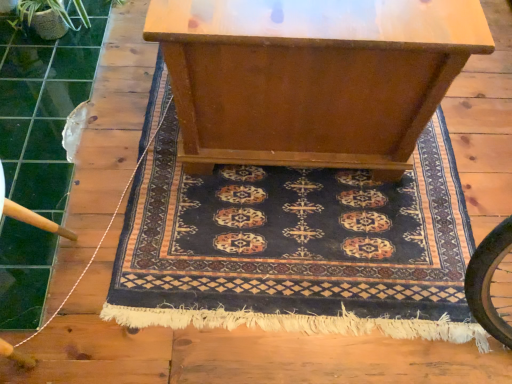
Question: Considering the positions of green textured plant at upper left and wooden table at center in the image, is green textured plant at upper left taller or shorter than wooden table at center?

Choices:
 (A) tall
 (B) short

Answer: (B)

Question: In the image, is green textured plant at upper left on the left side or the right side of wooden table at center?

Choices:
 (A) right
 (B) left

Answer: (B)

Question: Which object is positioned closest to the dark blue woven rug at center?

Choices:
 (A) white string at left
 (B) wooden table at center
 (C) green textured plant at upper left

Answer: (B)

Question: Estimate the real-world distances between objects in this image. Which object is farther from the dark blue woven rug at center?

Choices:
 (A) wooden table at center
 (B) green textured plant at upper left
 (C) white string at left

Answer: (B)